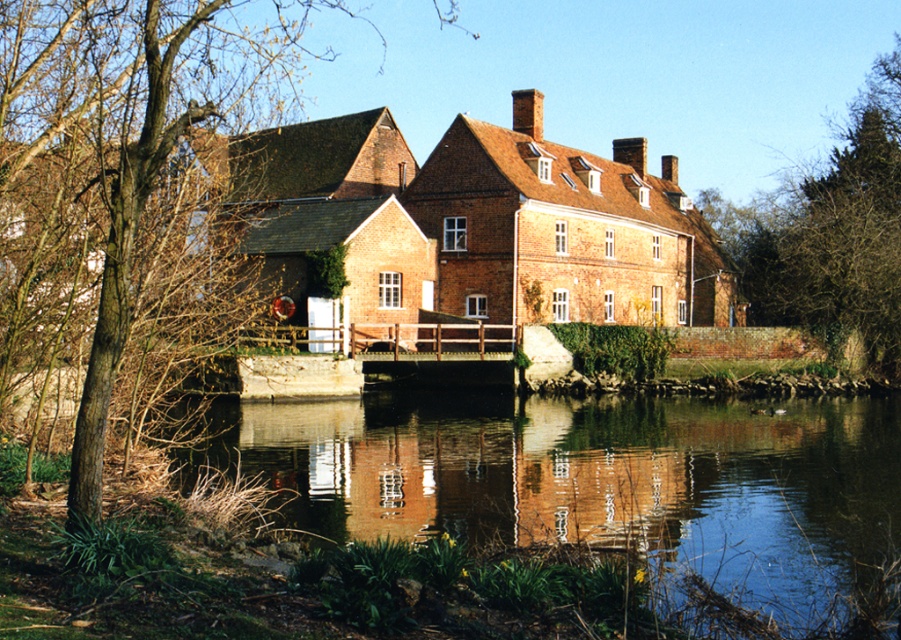
You are a visitor approaching the historic building by walking over the wooden bridge. As you look towards the entrance, which tree do you see first, the brown leafless tree at left or the green leafy tree at upper right?

The brown leafless tree at left is closer to the entrance than the green leafy tree at upper right, so you will see the brown leafless tree at left first.

You are planning to place a small boat on the smooth reflective water at center. The boat requires a space wider than the green leafy tree at upper right to maneuver safely. Is the water wide enough?

The smooth reflective water at center is narrower than the green leafy tree at upper right, so it is not wide enough for the boat to maneuver safely.

You are standing at the entrance of the historic building and notice a point marked at coordinates (119, 182). What object is located at that point?

The point at coordinates (119, 182) marks a brown leafless tree at left.